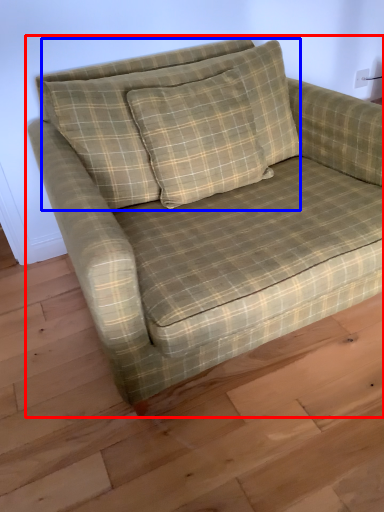
Question: Among these objects, which one is nearest to the camera, studio couch (highlighted by a red box) or pillow (highlighted by a blue box)?

Choices:
 (A) studio couch
 (B) pillow

Answer: (A)